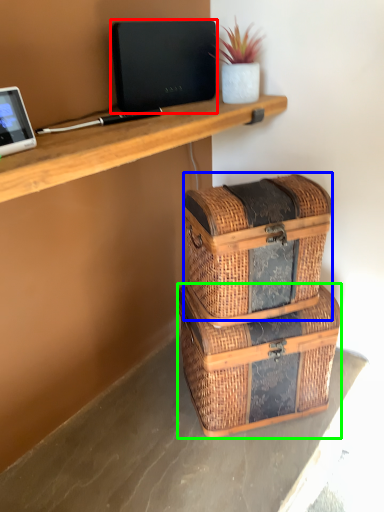
Question: Which object is the farthest from laptop (highlighted by a red box)? Choose among these: storage box (highlighted by a blue box) or storage box (highlighted by a green box).

Choices:
 (A) storage box
 (B) storage box

Answer: (B)